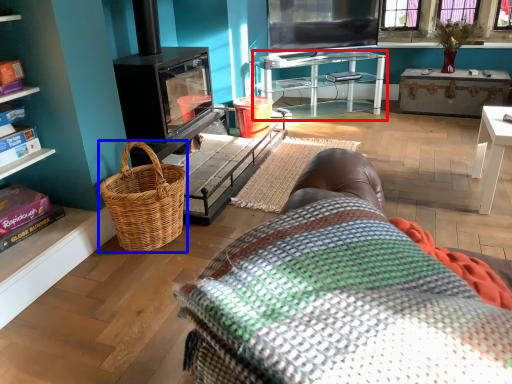
Question: Which point is closer to the camera, table (highlighted by a red box) or picnic basket (highlighted by a blue box)?

Choices:
 (A) table
 (B) picnic basket

Answer: (B)